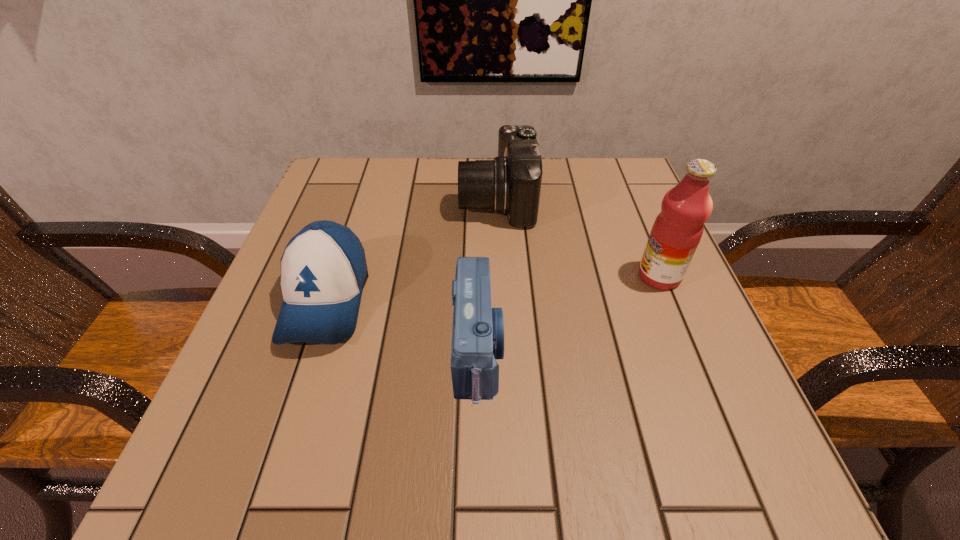
Find the location of a particular element. Image resolution: width=960 pixels, height=540 pixels. vacant position located on the lens of the farthest object is located at coordinates (335, 200).

The width and height of the screenshot is (960, 540). Find the location of `free space located 0.190m on the lens of the farthest object`. free space located 0.190m on the lens of the farthest object is located at coordinates click(x=378, y=200).

At what (x,y) coordinates should I click in order to perform the action: click on free space located on the front-facing side of the baseball cap. Please return your answer as a coordinate pair (x, y). Looking at the image, I should click on (281, 434).

Where is `vacant region located 0.290m on the lens of the shorter camera`? The height and width of the screenshot is (540, 960). vacant region located 0.290m on the lens of the shorter camera is located at coordinates (680, 349).

The height and width of the screenshot is (540, 960). What are the coordinates of `object located at the far edge` in the screenshot? It's located at (510, 184).

Locate an element on the screen. The width and height of the screenshot is (960, 540). object located at the left edge is located at coordinates (323, 268).

I want to click on object that is positioned at the right edge, so click(677, 230).

This screenshot has width=960, height=540. Find the location of `blank space at the far edge of the desktop`. blank space at the far edge of the desktop is located at coordinates (554, 180).

Locate an element on the screen. vacant space at the near edge of the desktop is located at coordinates (530, 454).

In the image, there is a desktop. What are the coordinates of `free space at the left edge` in the screenshot? It's located at (239, 380).